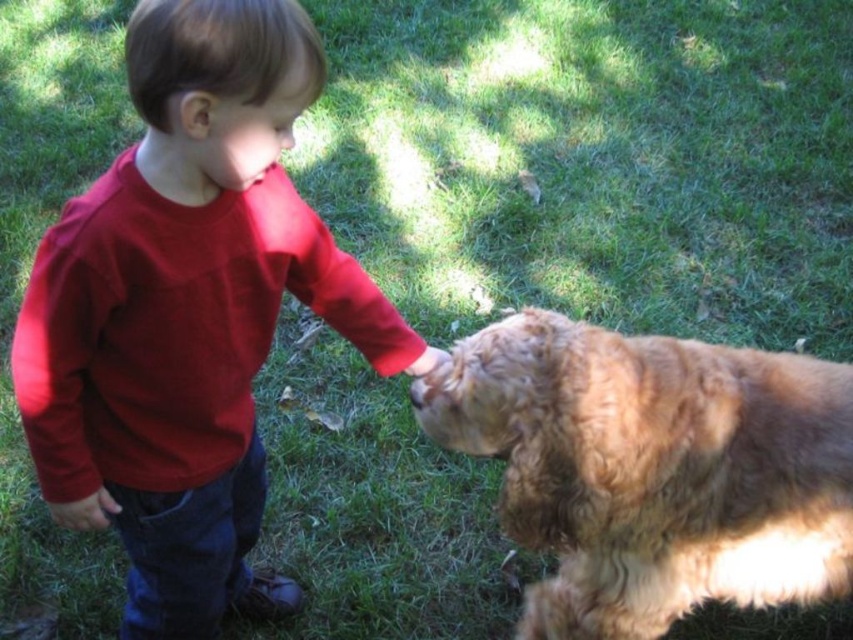
Question: Is smooth red shirt at center positioned before golden fur dog at right?

Choices:
 (A) no
 (B) yes

Answer: (B)

Question: Among these points, which one is farthest from the camera?

Choices:
 (A) (645, 440)
 (B) (33, 420)

Answer: (A)

Question: Which object appears closest to the camera in this image?

Choices:
 (A) golden fur dog at right
 (B) smooth red shirt at center

Answer: (B)

Question: Does smooth red shirt at center appear on the right side of golden fur dog at right?

Choices:
 (A) yes
 (B) no

Answer: (B)

Question: Among these points, which one is nearest to the camera?

Choices:
 (A) (728, 406)
 (B) (308, 289)

Answer: (A)

Question: Is smooth red shirt at center behind golden fur dog at right?

Choices:
 (A) yes
 (B) no

Answer: (B)